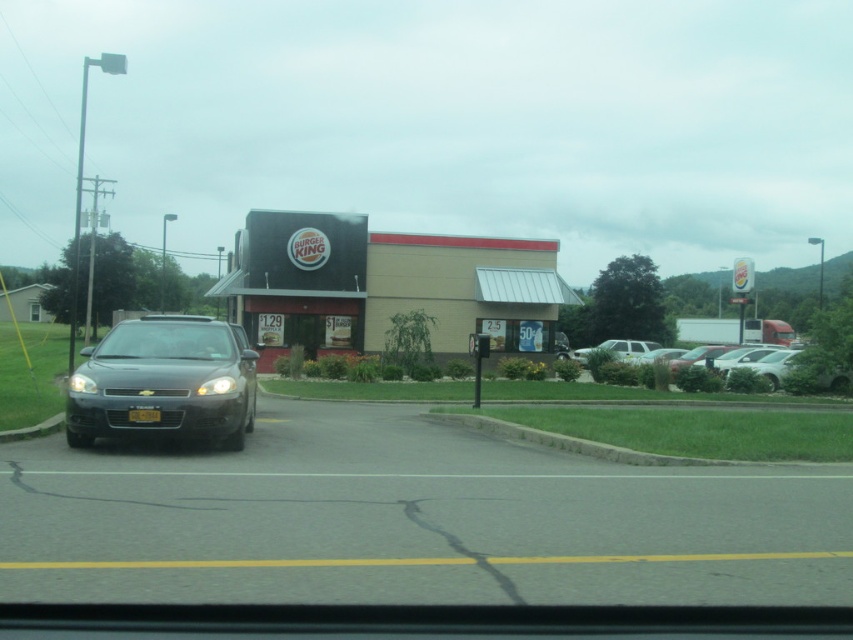
You are a delivery driver approaching the Burger King restaurant and notice a matte black sedan at center and a yellow matte license plate at center in the parking lot. Which object is closer to the left side of the license plate?

The matte black sedan at center is positioned on the left side of yellow matte license plate at center, so it is closer to the left side of the license plate.